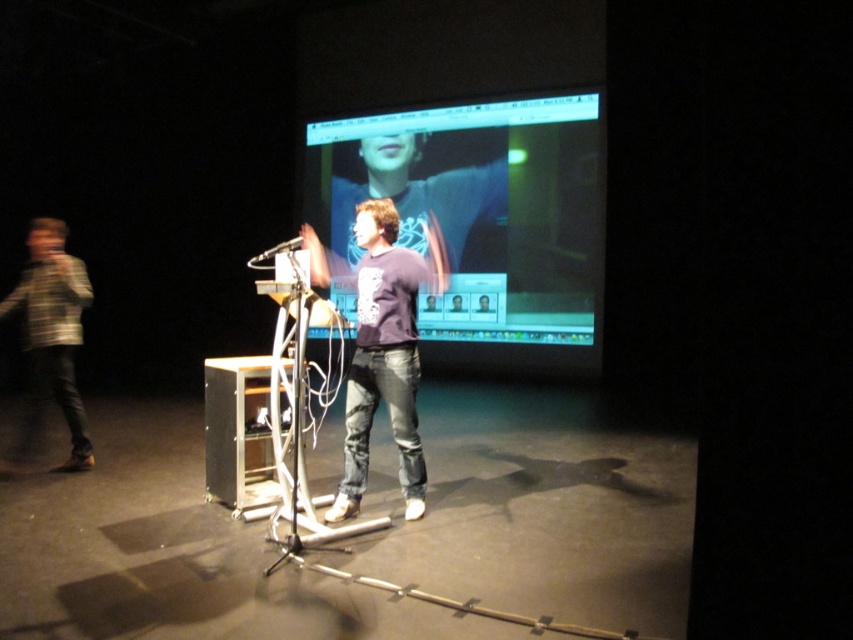
You are an event technician adjusting the stage setup. You need to ensure that the matte black monitor at center is visible to the audience without being blocked by the metallic silver microphone at center. Based on their current positions, will the microphone block the monitor?

The matte black monitor at center is positioned over the metallic silver microphone at center, so the microphone will not block the monitor as it is placed below it.

You are an event organizer setting up the stage for a presentation. You need to ensure that the purple cotton shirt at center and the metallic silver microphone at center are arranged so that the microphone is clearly visible to the audience. Based on their current positions, is the microphone placed correctly for visibility?

The purple cotton shirt at center is positioned on the right side of the metallic silver microphone at center, which means the microphone is to the left of the shirt. Since the shirt might block the microphone from the audience if it is to the right, the microphone should be moved to the left side of the shirt to ensure visibility.

You are an event organizer who needs to ensure that all equipment is visible to the audience. Given the purple cotton shirt at center and the metallic silver microphone at center, which one is taller and might block the view of the other?

The purple cotton shirt at center has a greater height compared to the metallic silver microphone at center, so it might block the view of the microphone.